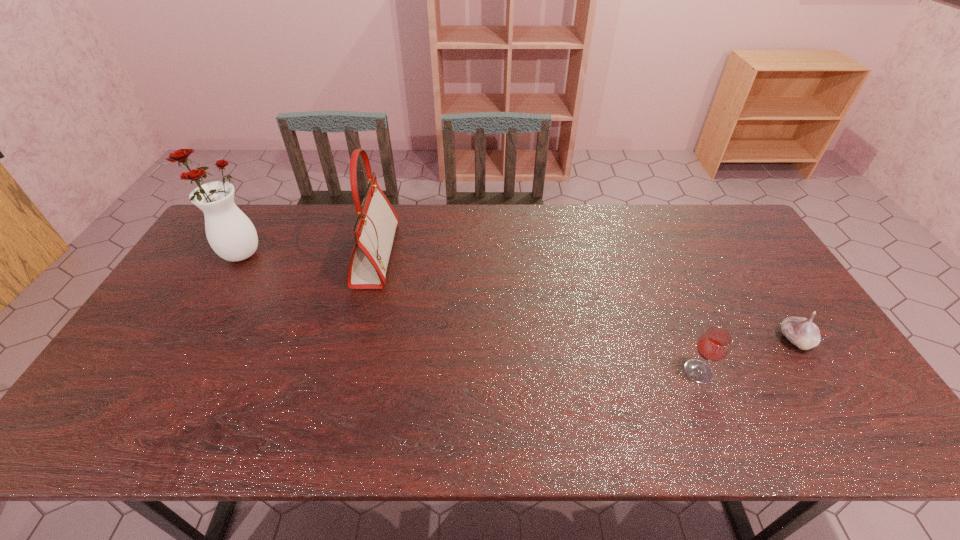
Identify the location of the third object from right to left. The height and width of the screenshot is (540, 960). (374, 231).

Identify the location of the leftmost object. This screenshot has height=540, width=960. pyautogui.click(x=230, y=233).

The image size is (960, 540). In order to click on the third tallest object in this screenshot , I will do `click(714, 344)`.

Where is `wineglass`? Image resolution: width=960 pixels, height=540 pixels. wineglass is located at coordinates (714, 344).

This screenshot has width=960, height=540. I want to click on the second nearest object, so [x=802, y=332].

Find the location of a particular element. This screenshot has height=540, width=960. the rightmost object is located at coordinates (802, 332).

Image resolution: width=960 pixels, height=540 pixels. Identify the location of free region located 0.250m on the left of the second object from left to right. (281, 254).

Where is `vacant point located 0.180m on the front of the vase`? Image resolution: width=960 pixels, height=540 pixels. vacant point located 0.180m on the front of the vase is located at coordinates (204, 314).

You are a GUI agent. You are given a task and a screenshot of the screen. Output one action in this format:
    pyautogui.click(x=<x>, y=<y>)
    Task: Click on the vacant region located on the back of the second shortest object
    This screenshot has width=960, height=540.
    Given the screenshot: What is the action you would take?
    pyautogui.click(x=684, y=338)

You are a GUI agent. You are given a task and a screenshot of the screen. Output one action in this format:
    pyautogui.click(x=<x>, y=<y>)
    Task: Click on the vacant space positioned on the front of the shortest object
    The width and height of the screenshot is (960, 540).
    Given the screenshot: What is the action you would take?
    pyautogui.click(x=827, y=388)